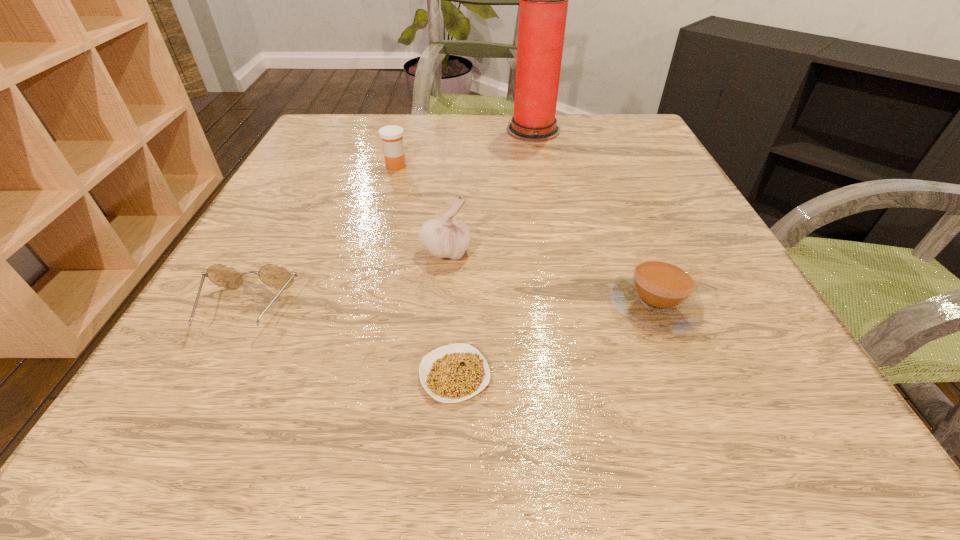
Where is `vacant space that's between the fifth shortest object and the cappuccino`? vacant space that's between the fifth shortest object and the cappuccino is located at coordinates (550, 278).

The height and width of the screenshot is (540, 960). Identify the location of vacant space that's between the third farthest object and the second farthest object. (421, 208).

I want to click on vacant space in between the fire extinguisher and the cappuccino, so click(x=593, y=218).

Where is `blank region between the fire extinguisher and the legume`? The image size is (960, 540). blank region between the fire extinguisher and the legume is located at coordinates (494, 253).

Locate an element on the screen. This screenshot has height=540, width=960. free space that is in between the tallest object and the second tallest object is located at coordinates (490, 190).

Identify the location of vacant point located between the third farthest object and the cappuccino. (550, 278).

Where is `unoccupied position between the fourth nearest object and the second object from left to right`? The width and height of the screenshot is (960, 540). unoccupied position between the fourth nearest object and the second object from left to right is located at coordinates coord(421,208).

At what (x,y) coordinates should I click in order to perform the action: click on free space between the fifth shortest object and the spectacles. Please return your answer as a coordinate pair (x, y). This screenshot has height=540, width=960. Looking at the image, I should click on (346, 280).

This screenshot has width=960, height=540. What are the coordinates of `unoccupied position between the tallest object and the medicine` in the screenshot? It's located at (465, 148).

Where is `vacant space that's between the spectacles and the tallest object`? vacant space that's between the spectacles and the tallest object is located at coordinates (390, 220).